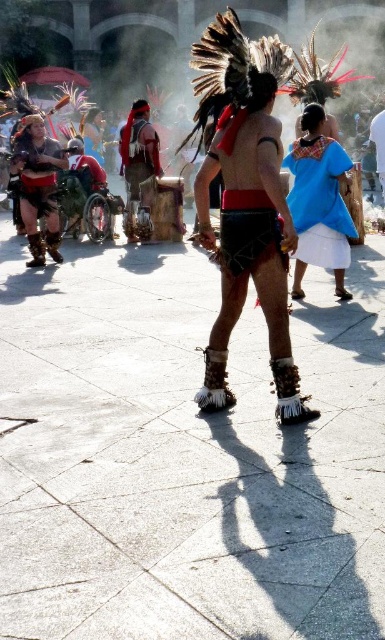
Looking at this image, is leather moccasins at center to the right of red feather headdress at center from the viewer's perspective?

Correct, you'll find leather moccasins at center to the right of red feather headdress at center.

Is leather moccasins at center taller than red feather headdress at center?

Yes, leather moccasins at center is taller than red feather headdress at center.

Is point (301, 397) positioned in front of point (125, 209)?

Yes, it is in front of point (125, 209).

I want to click on leather moccasins at center, so click(x=249, y=243).

Is leather moccasins at center wider than blue cotton shirt at upper right?

Indeed, leather moccasins at center has a greater width compared to blue cotton shirt at upper right.

Where is `leather moccasins at center`? The width and height of the screenshot is (385, 640). leather moccasins at center is located at coordinates (249, 243).

Measure the distance between blue cotton shirt at upper right and camera.

12.13 meters

Who is more distant from viewer, (x=351, y=221) or (x=61, y=164)?

Point (x=61, y=164)

At what (x,y) coordinates should I click in order to perform the action: click on blue cotton shirt at upper right. Please return your answer as a coordinate pair (x, y). Looking at the image, I should click on pos(319,202).